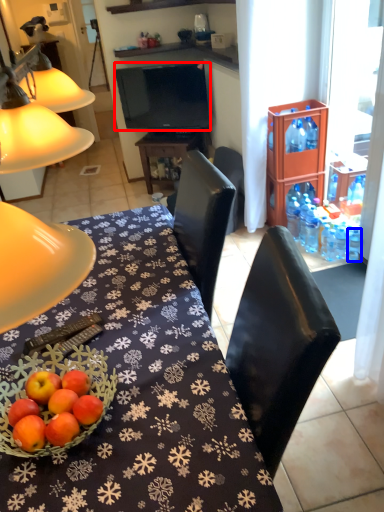
Question: Which object appears farthest to the camera in this image, television (highlighted by a red box) or bottle (highlighted by a blue box)?

Choices:
 (A) television
 (B) bottle

Answer: (A)